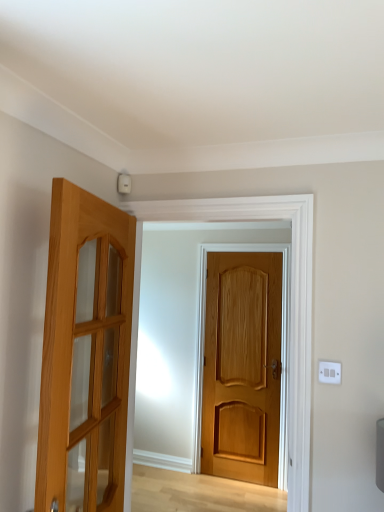
Question: Should I look upward or downward to see light brown wooden door at center, acting as the 2th door starting from the left?

Choices:
 (A) up
 (B) down

Answer: (B)

Question: Does light brown wooden door at center, the 1th door positioned from the back, have a greater width compared to white plastic switch at upper right?

Choices:
 (A) yes
 (B) no

Answer: (A)

Question: Is light brown wooden door at center, acting as the 2th door starting from the left, outside white plastic switch at upper right?

Choices:
 (A) no
 (B) yes

Answer: (B)

Question: Considering the relative positions of light brown wooden door at center, the 1th door positioned from the back, and white plastic switch at upper right in the image provided, is light brown wooden door at center, the 1th door positioned from the back, to the right of white plastic switch at upper right from the viewer's perspective?

Choices:
 (A) no
 (B) yes

Answer: (A)

Question: From a real-world perspective, is light brown wooden door at center, arranged as the second door when viewed from the front, located beneath white plastic switch at upper right?

Choices:
 (A) no
 (B) yes

Answer: (B)

Question: Does light brown wooden door at center, the first door viewed from the right, turn towards white plastic switch at upper right?

Choices:
 (A) yes
 (B) no

Answer: (A)

Question: Is light brown wooden door at center, acting as the 2th door starting from the left, shorter than white plastic switch at upper right?

Choices:
 (A) no
 (B) yes

Answer: (A)

Question: Is white plastic switch at upper right facing towards light brown wooden door at left, marked as the 2th door in a back-to-front arrangement?

Choices:
 (A) no
 (B) yes

Answer: (A)

Question: From the image's perspective, is white plastic switch at upper right located above light brown wooden door at left, which appears as the second door when viewed from the right?

Choices:
 (A) yes
 (B) no

Answer: (B)

Question: Is white plastic switch at upper right far from light brown wooden door at left, placed as the 1th door when sorted from front to back?

Choices:
 (A) no
 (B) yes

Answer: (A)

Question: Can you confirm if white plastic switch at upper right is thinner than light brown wooden door at left, which appears as the second door when viewed from the right?

Choices:
 (A) no
 (B) yes

Answer: (B)

Question: Does white plastic switch at upper right have a lesser height compared to light brown wooden door at left, which appears as the second door when viewed from the right?

Choices:
 (A) yes
 (B) no

Answer: (A)

Question: Considering the relative sizes of white plastic switch at upper right and light brown wooden door at left, which appears as the second door when viewed from the right, in the image provided, is white plastic switch at upper right smaller than light brown wooden door at left, which appears as the second door when viewed from the right,?

Choices:
 (A) no
 (B) yes

Answer: (B)

Question: Is white plastic switch at upper right completely or partially outside of light brown wooden door at center, acting as the 2th door starting from the left?

Choices:
 (A) yes
 (B) no

Answer: (A)